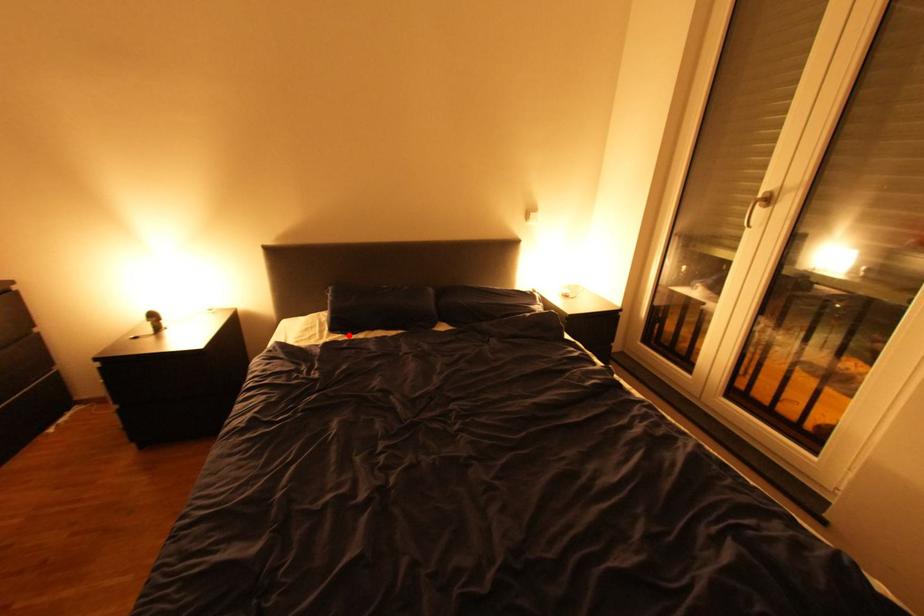
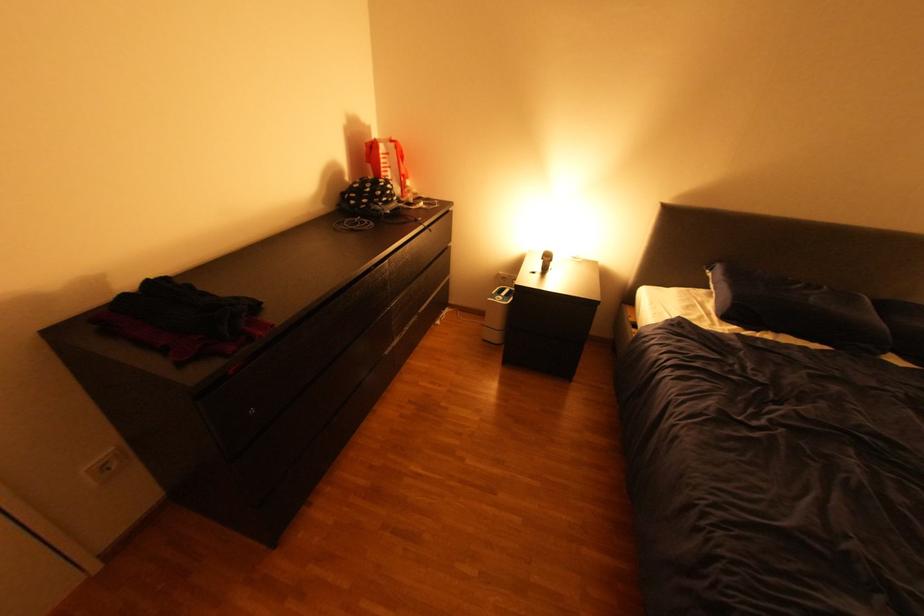
Find the pixel in the second image that matches the highlighted location in the first image.

(745, 326)